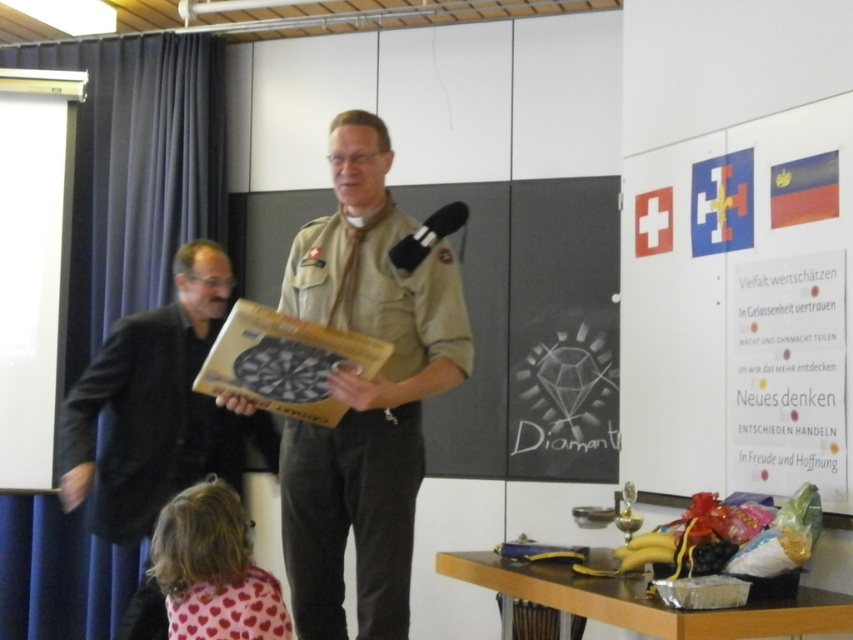
Between point (251, 406) and point (200, 627), which one is positioned in front?

Point (200, 627)

Is matte cardboard dartboard at center thinner than pink heart-patterned scarf at lower left?

Incorrect, matte cardboard dartboard at center's width is not less than pink heart-patterned scarf at lower left's.

Locate an element on the screen. matte cardboard dartboard at center is located at coordinates (364, 394).

Does matte cardboard dartboard at center have a lesser height compared to black matte jacket at left?

Yes, matte cardboard dartboard at center is shorter than black matte jacket at left.

Can you confirm if matte cardboard dartboard at center is bigger than black matte jacket at left?

No, matte cardboard dartboard at center is not bigger than black matte jacket at left.

Locate an element on the screen. This screenshot has height=640, width=853. matte cardboard dartboard at center is located at coordinates (364, 394).

What do you see at coordinates (213, 570) in the screenshot?
I see `pink heart-patterned shirt at lower left` at bounding box center [213, 570].

Between pink heart-patterned shirt at lower left and pink heart-patterned scarf at lower left, which one appears on the left side from the viewer's perspective?

pink heart-patterned shirt at lower left is more to the left.

What do you see at coordinates (213, 570) in the screenshot? This screenshot has height=640, width=853. I see `pink heart-patterned shirt at lower left` at bounding box center [213, 570].

Locate an element on the screen. The width and height of the screenshot is (853, 640). pink heart-patterned shirt at lower left is located at coordinates (213, 570).